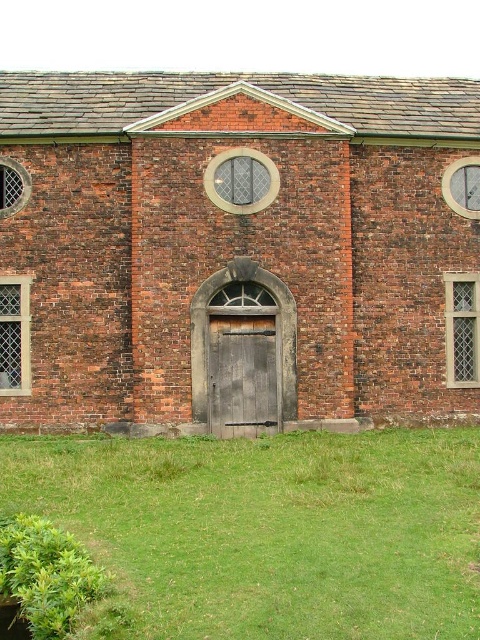
Question: Based on their relative distances, which object is farther from the smooth wooden door at center?

Choices:
 (A) wooden door at center
 (B) green grass at lower center

Answer: (B)

Question: Does smooth wooden door at center appear over green grass at lower center?

Choices:
 (A) no
 (B) yes

Answer: (B)

Question: Which of the following is the closest to the observer?

Choices:
 (A) green grass at lower center
 (B) wooden door at center

Answer: (A)

Question: Which point is farther from the camera taking this photo?

Choices:
 (A) (211, 348)
 (B) (367, 333)

Answer: (B)

Question: Can you confirm if green grass at lower center is thinner than wooden door at center?

Choices:
 (A) no
 (B) yes

Answer: (A)

Question: Is smooth wooden door at center to the right of wooden door at center from the viewer's perspective?

Choices:
 (A) no
 (B) yes

Answer: (B)